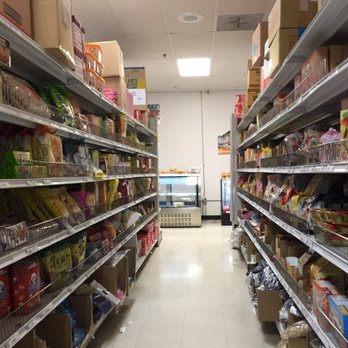
Locate an element on the screen. The height and width of the screenshot is (348, 348). vent cover is located at coordinates (236, 27).